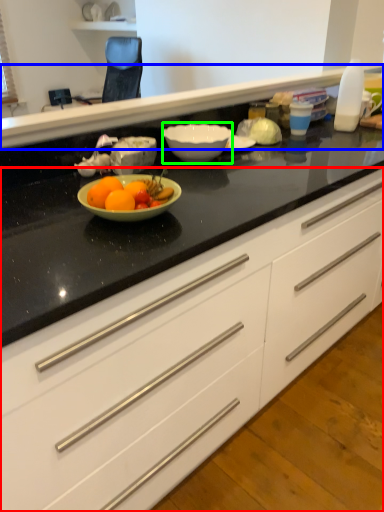
Question: Which object is the farthest from cabinetry (highlighted by a red box)? Choose among these: counter top (highlighted by a blue box) or bowl (highlighted by a green box).

Choices:
 (A) counter top
 (B) bowl

Answer: (A)